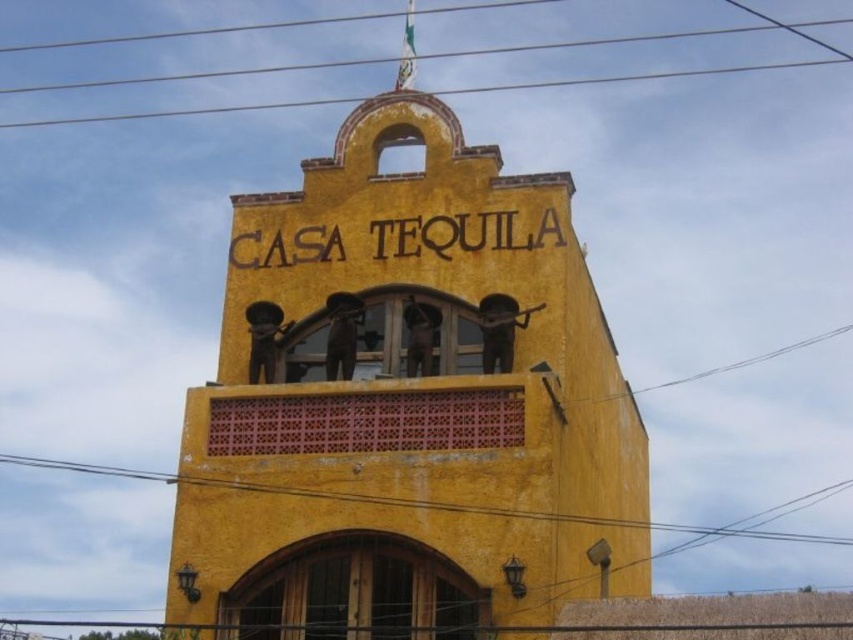
You are an architect analyzing the building structure of the yellow stucco building at center and the metallic wire at upper center. Which object would require more material to construct based on their sizes?

The yellow stucco building at center is larger in size than the metallic wire at upper center, so it would require more material to construct.

You are standing in front of the CASA TEQUILA building and notice two points marked on its facade. The first point is at coordinates point (492, 528) and the second at point (770, 518). Which of these points is positioned closer to your viewpoint?

Point (492, 528) is closer to the viewer than point (770, 518).

You are standing in front of the CASA TEQUILA building and notice the yellow stucco building at center and the metallic wire at upper center. Which object is located to the right of the other?

The yellow stucco building at center is positioned on the right side of metallic wire at upper center, so the yellow stucco building at center is to the right of the metallic wire at upper center.